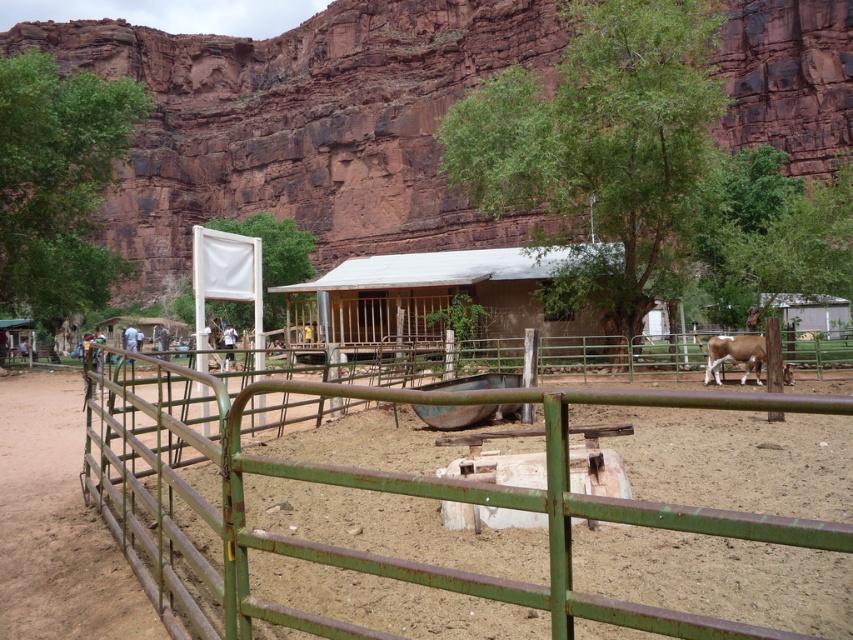
Who is lower down, rusty metal fence at lower left or brown wooden hut at center?

Positioned lower is rusty metal fence at lower left.

Does rusty metal fence at lower left lie in front of brown wooden hut at center?

Yes.

Does point (764, 403) come behind point (369, 314)?

No, it is not.

You are a GUI agent. You are given a task and a screenshot of the screen. Output one action in this format:
    pyautogui.click(x=<x>, y=<y>)
    Task: Click on the rusty metal fence at lower left
    The height and width of the screenshot is (640, 853).
    Given the screenshot: What is the action you would take?
    pyautogui.click(x=376, y=490)

Who is taller, brown wooden hut at center or brown speckled hide at right?

brown wooden hut at center is taller.

Which is below, brown wooden hut at center or brown speckled hide at right?

brown speckled hide at right is lower down.

This screenshot has height=640, width=853. Find the location of `brown wooden hut at center`. brown wooden hut at center is located at coordinates (440, 298).

Between rusty metal fence at lower left and brown speckled hide at right, which one has less height?

Standing shorter between the two is brown speckled hide at right.

From the picture: Is rusty metal fence at lower left bigger than brown speckled hide at right?

Yes.

Is point (285, 408) positioned behind point (721, 352)?

That is False.

Find the location of a particular element. This screenshot has height=640, width=853. rusty metal fence at lower left is located at coordinates (376, 490).